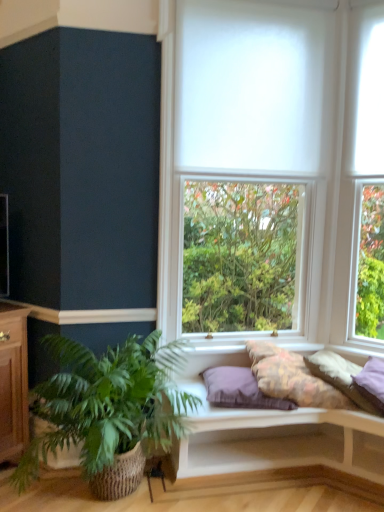
Question: Considering the positions of white cushioned bench at lower center and purple fabric pillow at center, which ranks as the 3th pillow in right-to-left order, in the image, is white cushioned bench at lower center taller or shorter than purple fabric pillow at center, which ranks as the 3th pillow in right-to-left order,?

Choices:
 (A) short
 (B) tall

Answer: (B)

Question: Choose the correct answer: Is white cushioned bench at lower center inside purple fabric pillow at center, which ranks as the 3th pillow in right-to-left order, or outside it?

Choices:
 (A) outside
 (B) inside

Answer: (A)

Question: Estimate the real-world distances between objects in this image. Which object is closer to the white matte blind at upper center?

Choices:
 (A) fluffy white pillow at right, marked as the 1th pillow in a right-to-left arrangement
 (B) fluffy cotton pillow at center, which is the 2th pillow in right-to-left order
 (C) green woven basket at lower left
 (D) white matte window at center
 (E) white cushioned bench at lower center

Answer: (D)

Question: Which object is the closest to the white matte blind at upper center?

Choices:
 (A) fluffy cotton pillow at center, the second pillow in the left-to-right sequence
 (B) fluffy white pillow at right, which is the third pillow in left-to-right order
 (C) white cushioned bench at lower center
 (D) green woven basket at lower left
 (E) white matte window at center

Answer: (E)